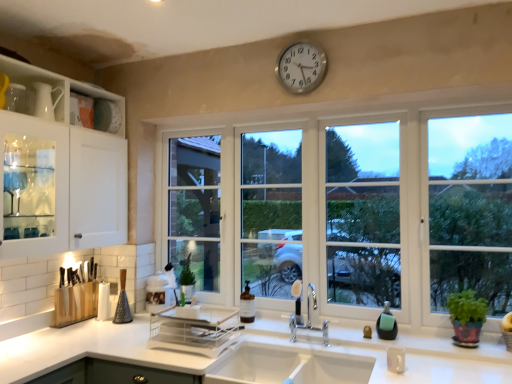
Question: In terms of height, does green leafy plant in pot at right look taller or shorter compared to white glass window at center?

Choices:
 (A) tall
 (B) short

Answer: (B)

Question: From the image's perspective, is green leafy plant in pot at right located above or below white glass window at center?

Choices:
 (A) below
 (B) above

Answer: (A)

Question: Based on their relative distances, which object is nearer to the translucent glass soap dispenser at sink?

Choices:
 (A) white ceramic sink at center
 (B) white glass window at center
 (C) silver metallic clock at upper center
 (D) white glossy countertop at lower center
 (E) white glossy cabinet at left

Answer: (A)

Question: Which object is positioned farthest from the white glossy countertop at lower center?

Choices:
 (A) white glossy cabinet at left
 (B) silver metallic clock at upper center
 (C) translucent glass soap dispenser at sink
 (D) green leafy plant in pot at right
 (E) white glass window at center

Answer: (A)